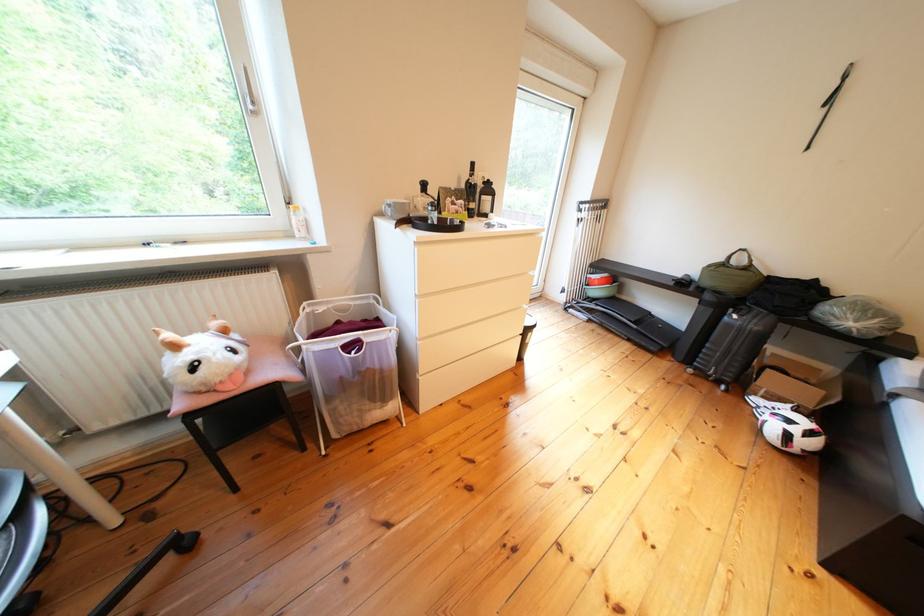
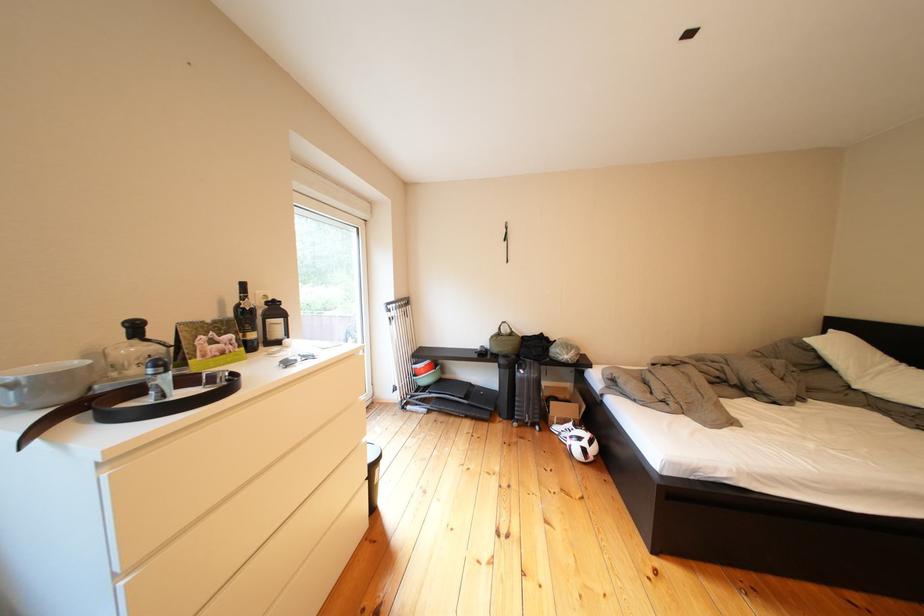
Locate, in the second image, the point that corresponds to (638,302) in the first image.

(462, 381)